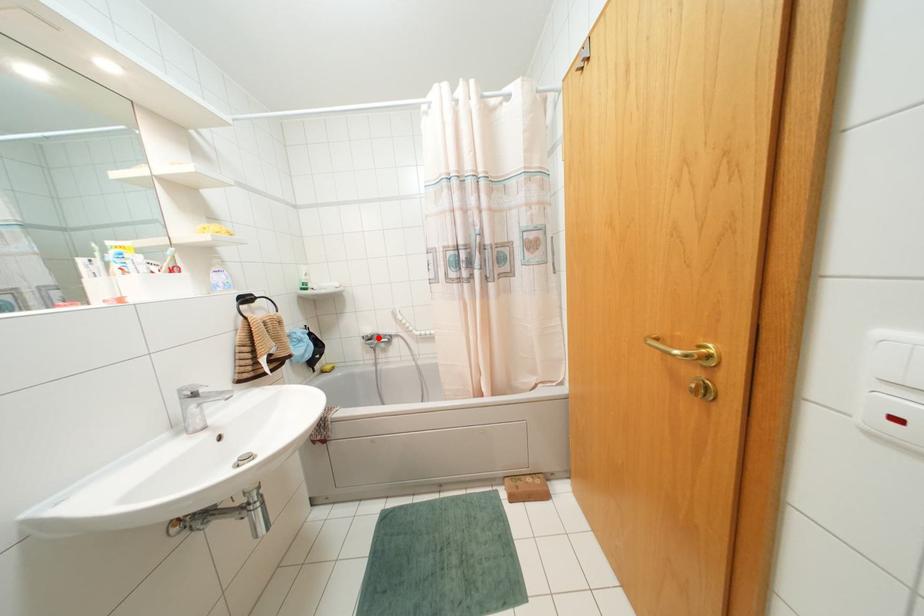
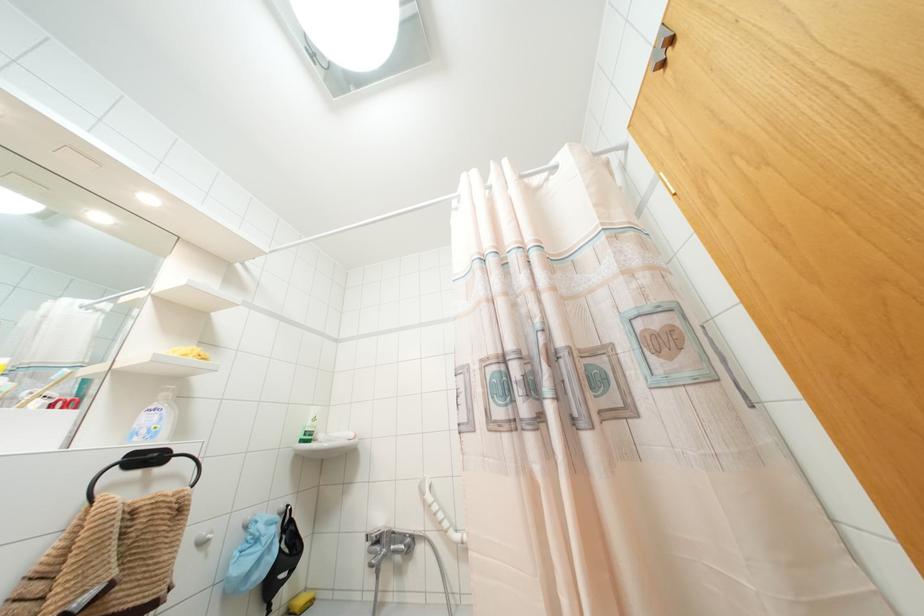
Where in the second image is the point corresponding to the highlighted location from the first image?

(390, 541)